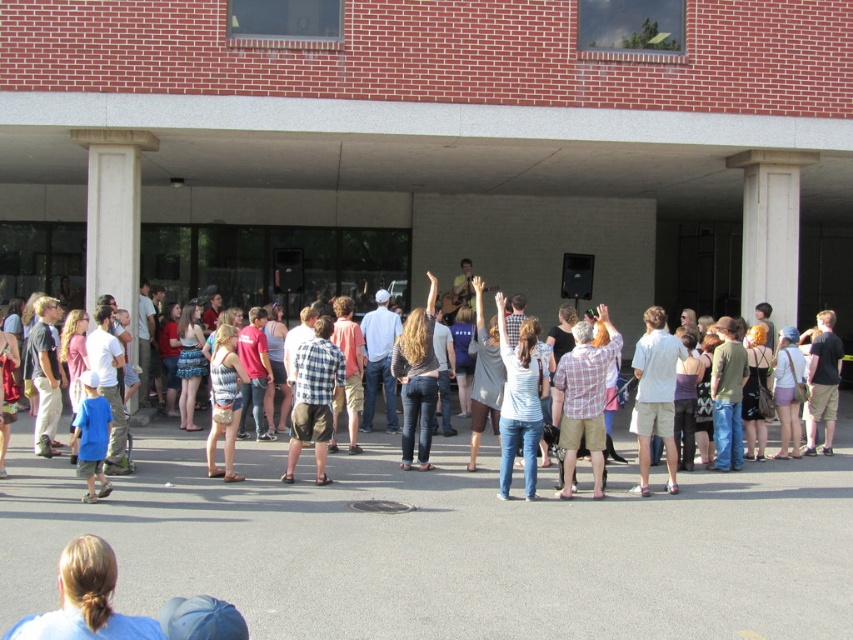
Question: Where is denim jeans at center located in relation to white concrete column at center in the image?

Choices:
 (A) below
 (B) above

Answer: (A)

Question: Which object is farther from the camera taking this photo?

Choices:
 (A) white concrete column at center
 (B) denim jeans at center

Answer: (A)

Question: Is denim jeans at center below white concrete column at center?

Choices:
 (A) no
 (B) yes

Answer: (B)

Question: Which object appears farthest from the camera in this image?

Choices:
 (A) denim jeans at center
 (B) white concrete column at center

Answer: (B)

Question: Does denim jeans at center appear on the right side of white concrete column at center?

Choices:
 (A) yes
 (B) no

Answer: (B)